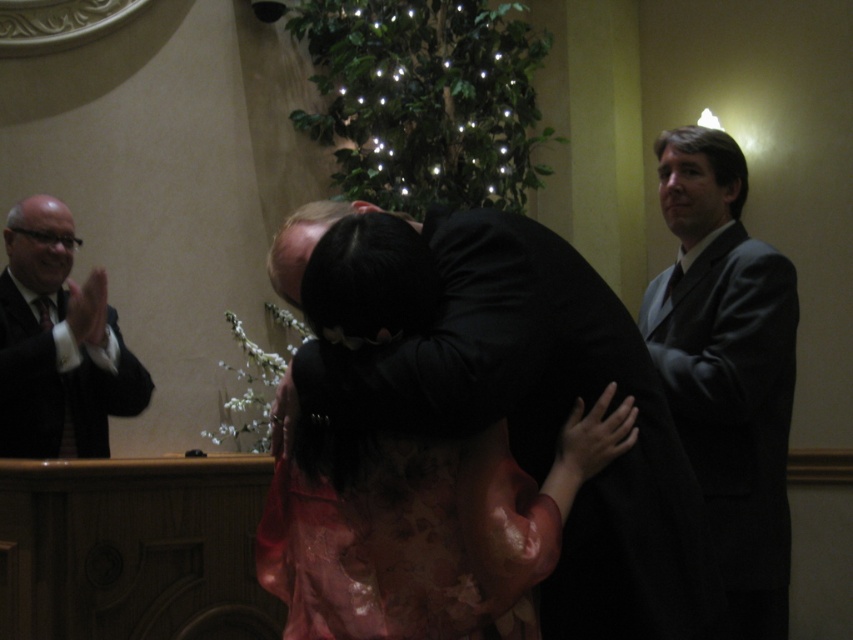
You are a photographer at the event and want to capture a photo of both the floral lace dress at center and the black suit at left. To ensure both are in frame, should you adjust your camera to focus more to the right or the left?

The floral lace dress at center is to the right of black suit at left, so to include both in the frame, you should adjust your camera to focus more to the left to ensure the black suit at left is fully captured while still including the floral lace dress at center.

You are a photographer at the event and need to capture a group photo of the dark gray suit at right and the black suit at left. The camera you have can only focus on subjects within a 5 feet range. Will both subjects be in focus if they remain at their current positions?

The distance between the dark gray suit at right and the black suit at left is 5.76 feet, which exceeds the camera focus range of 5 feet. Therefore, both subjects will not be in focus simultaneously.